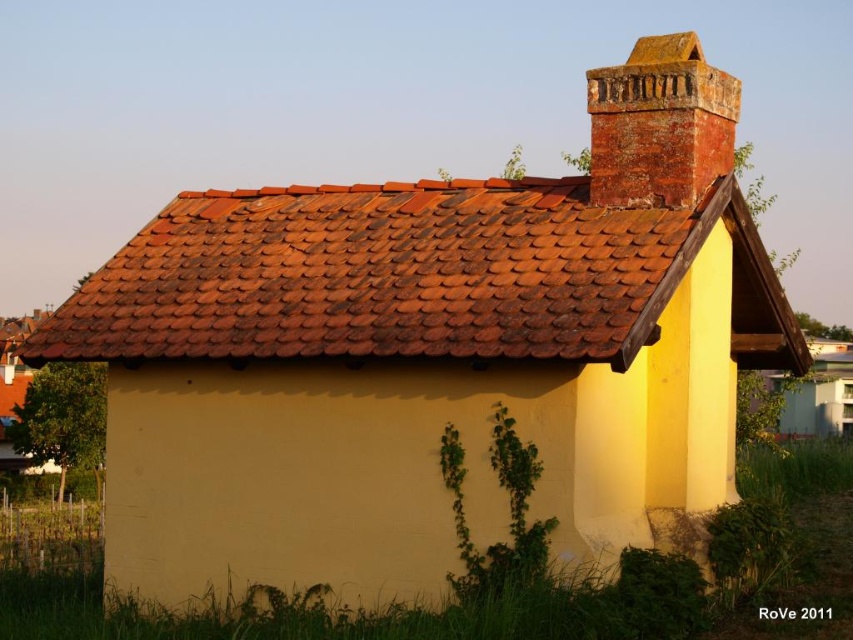
Question: Among these points, which one is nearest to the camera?

Choices:
 (A) (190, 280)
 (B) (701, 106)

Answer: (B)

Question: Which of the following is the farthest from the observer?

Choices:
 (A) (670, 96)
 (B) (628, 342)

Answer: (A)

Question: Does rusty clay tiles at upper center appear on the right side of rusty brick chimney at upper right?

Choices:
 (A) no
 (B) yes

Answer: (A)

Question: Which object appears farthest from the camera in this image?

Choices:
 (A) rusty clay tiles at upper center
 (B) rusty brick chimney at upper right

Answer: (B)

Question: In this image, where is rusty clay tiles at upper center located relative to rusty brick chimney at upper right?

Choices:
 (A) right
 (B) left

Answer: (B)

Question: Is rusty clay tiles at upper center further to the viewer compared to rusty brick chimney at upper right?

Choices:
 (A) no
 (B) yes

Answer: (A)